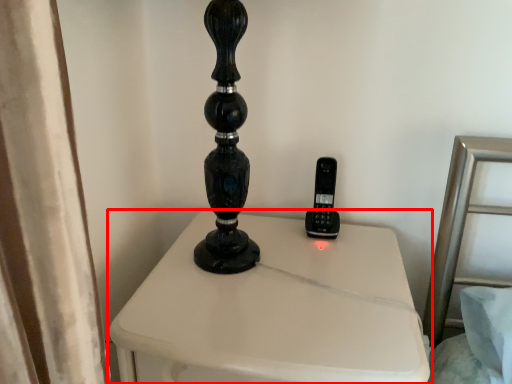
Question: Considering the relative positions of furniture (annotated by the red box) and control in the image provided, where is furniture (annotated by the red box) located with respect to the staircase?

Choices:
 (A) right
 (B) left

Answer: (B)